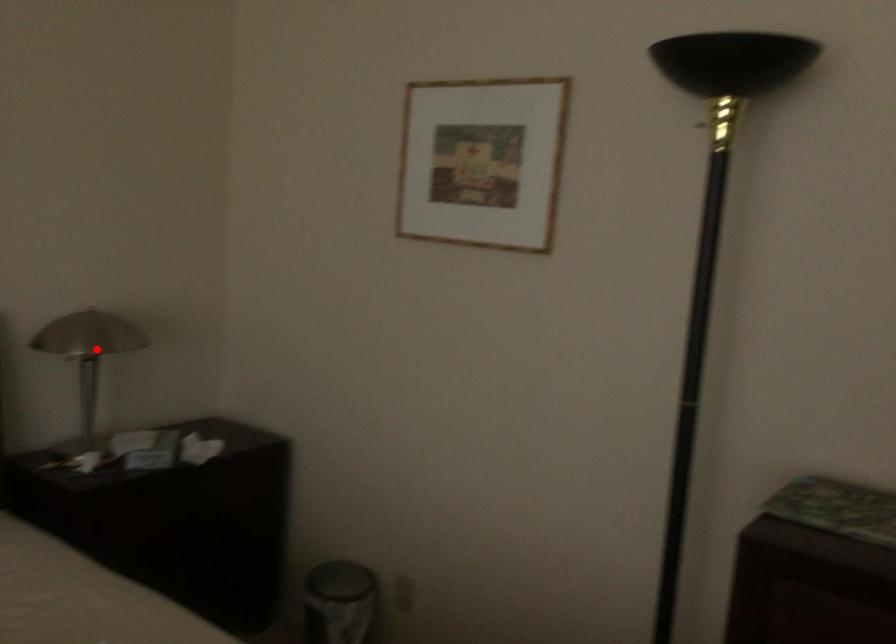
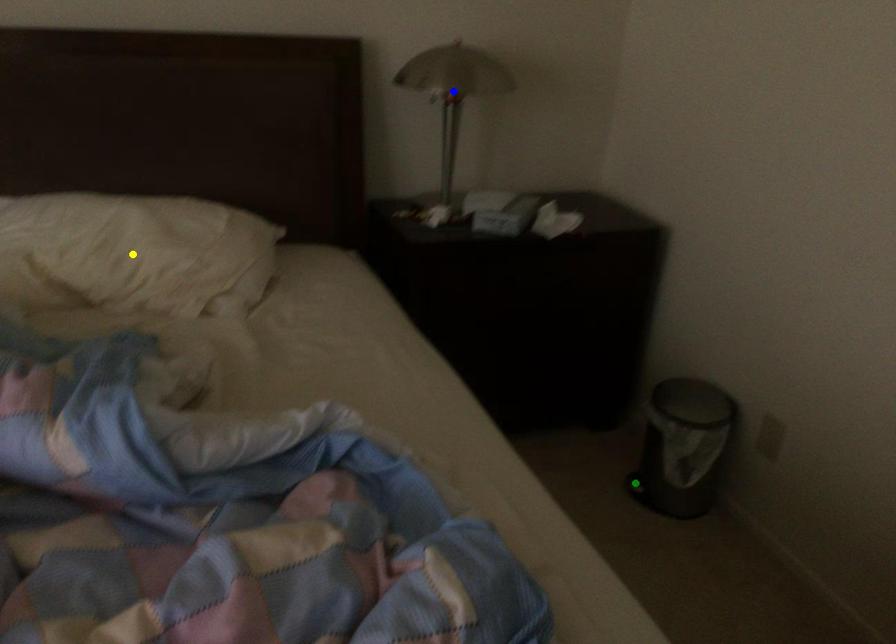
Question: I am providing you with two images of the same scene from different viewpoints. A red point is marked on the first image. You are given multiple points on the second image. Which point in image 2 is actually the same real-world point as the red point in image 1?

Choices:
 (A) blue point
 (B) green point
 (C) yellow point

Answer: (A)